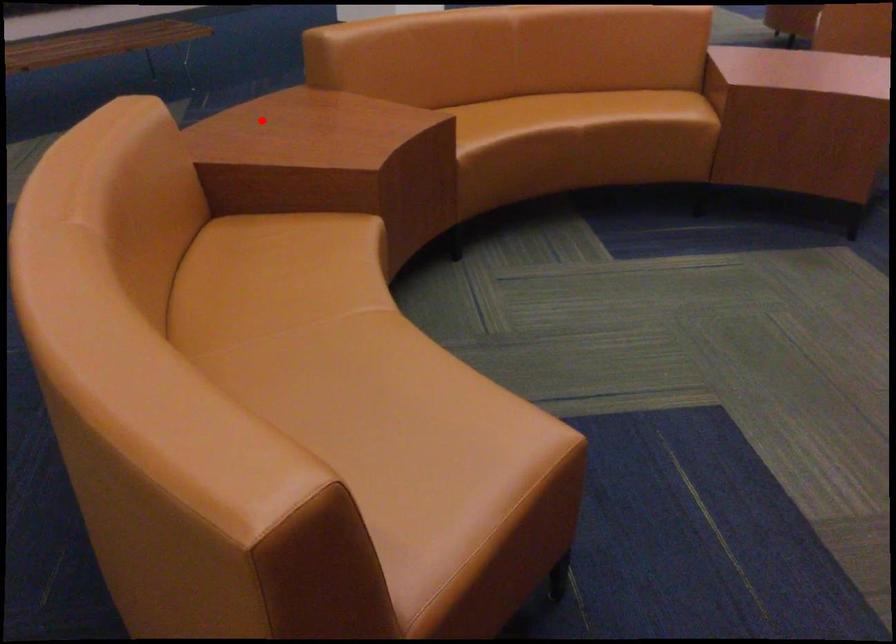
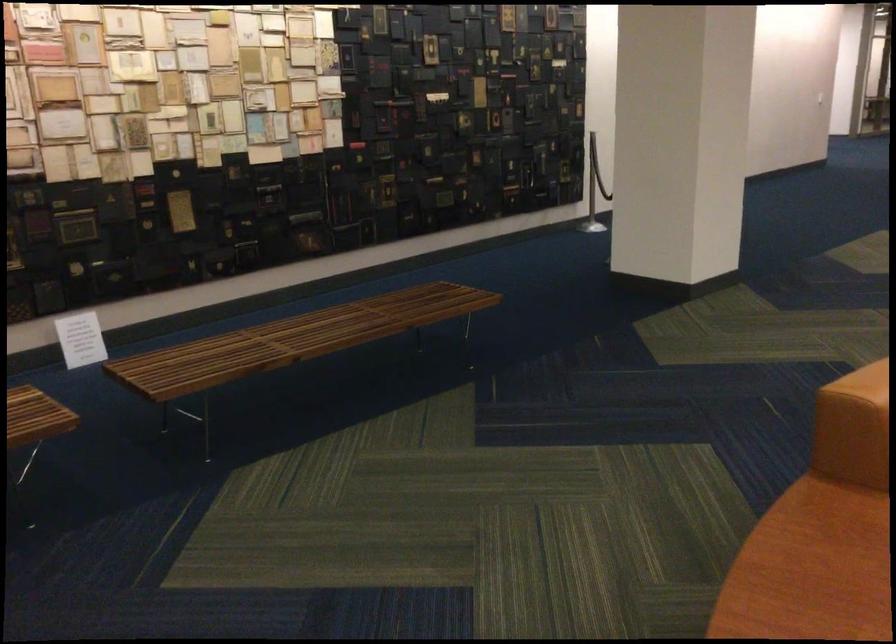
Question: I am providing you with two images of the same scene from different viewpoints. A red point is shown in image1. For the corresponding object point in image2, is it positioned nearer or farther from the camera?

Choices:
 (A) Nearer
 (B) Farther

Answer: (A)